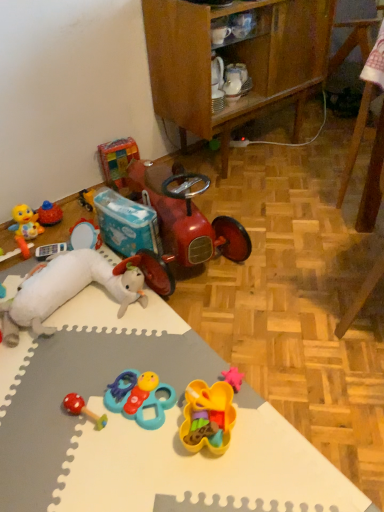
Locate an element on the screen. vacant area located to the right-hand side of translucent plastic toy at center, which ranks as the second toy in bottom-to-top order is located at coordinates (267, 426).